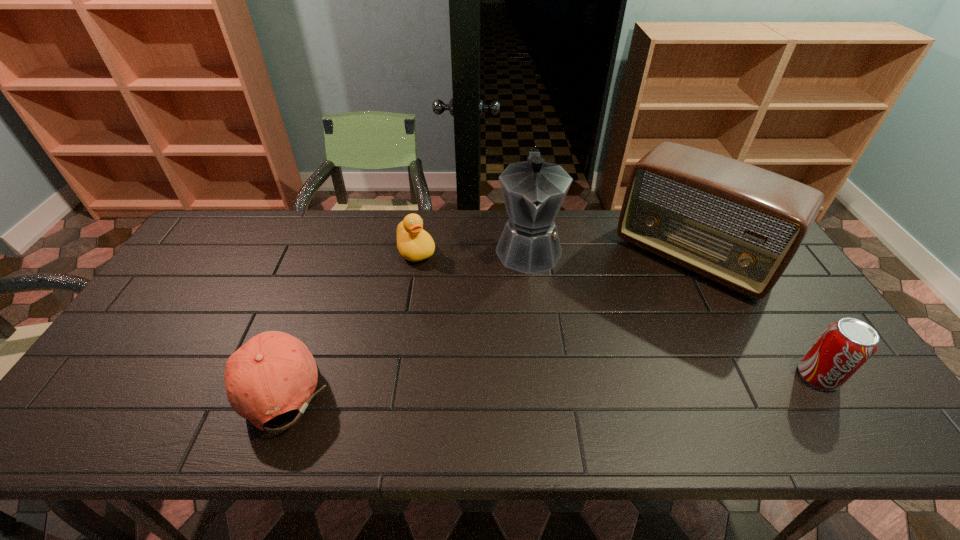
The width and height of the screenshot is (960, 540). Identify the location of the leftmost object. (274, 372).

Where is `soda can`? soda can is located at coordinates (842, 349).

Where is `coffeepot`? Image resolution: width=960 pixels, height=540 pixels. coffeepot is located at coordinates (534, 190).

This screenshot has height=540, width=960. I want to click on radio receiver, so click(x=740, y=225).

This screenshot has height=540, width=960. What are the coordinates of `the second object from left to right` in the screenshot? It's located at (414, 244).

Locate an element on the screen. The image size is (960, 540). vacant space located on the front-facing side of the baseball cap is located at coordinates (100, 382).

Where is `vacant area situated 0.090m on the front-facing side of the baseball cap`? vacant area situated 0.090m on the front-facing side of the baseball cap is located at coordinates (191, 382).

Locate an element on the screen. vacant space located 0.050m on the front-facing side of the baseball cap is located at coordinates (207, 382).

This screenshot has height=540, width=960. Find the location of `free point located on the back of the soda can`. free point located on the back of the soda can is located at coordinates (752, 272).

Locate an element on the screen. vacant space located at the spout of the third object from left to right is located at coordinates (531, 311).